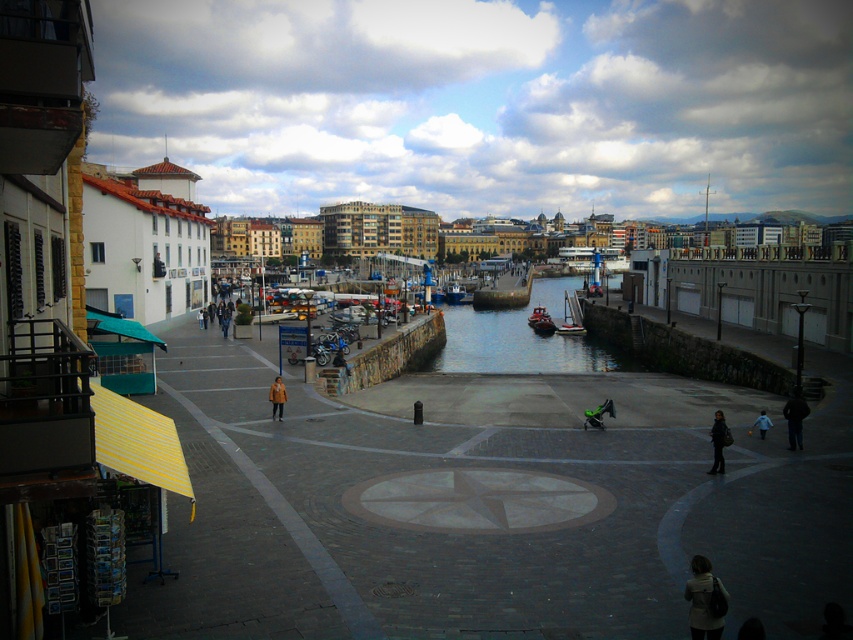
Question: Does clear water at center appear over smooth wooden boat at center?

Choices:
 (A) yes
 (B) no

Answer: (B)

Question: Is light gray fabric jacket at lower right bigger than wooden boat at center?

Choices:
 (A) yes
 (B) no

Answer: (B)

Question: Which point appears closest to the camera in this image?

Choices:
 (A) (483, 308)
 (B) (457, 300)

Answer: (A)

Question: Does clear water at center have a larger size compared to orange leather jacket at lower center?

Choices:
 (A) no
 (B) yes

Answer: (B)

Question: Which object is positioned farthest from the wooden boat at center?

Choices:
 (A) blue metallic boat at center
 (B) orange leather jacket at lower center

Answer: (B)

Question: Which point is farther from the camera taking this photo?

Choices:
 (A) (796, 401)
 (B) (509, 307)
 (C) (767, 426)

Answer: (B)